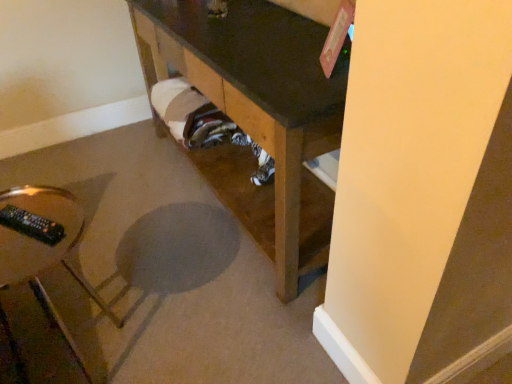
Where is `clear glass remote control at lower left, arranged as the 2th furniture when viewed from the right`? clear glass remote control at lower left, arranged as the 2th furniture when viewed from the right is located at coordinates (41, 287).

This screenshot has width=512, height=384. What do you see at coordinates (41, 287) in the screenshot? I see `clear glass remote control at lower left, arranged as the 2th furniture when viewed from the right` at bounding box center [41, 287].

This screenshot has height=384, width=512. Find the location of `brown wood table at lower center, acting as the second furniture starting from the left`. brown wood table at lower center, acting as the second furniture starting from the left is located at coordinates (258, 113).

What do you see at coordinates (258, 113) in the screenshot?
I see `brown wood table at lower center, acting as the second furniture starting from the left` at bounding box center [258, 113].

How much space does brown wood table at lower center, positioned as the 1th furniture in right-to-left order, occupy horizontally?

brown wood table at lower center, positioned as the 1th furniture in right-to-left order, is 21.70 inches wide.

Locate an element on the screen. The width and height of the screenshot is (512, 384). clear glass remote control at lower left, the first furniture when ordered from left to right is located at coordinates (41, 287).

Which object is positioned more to the right, brown wood table at lower center, positioned as the 1th furniture in right-to-left order, or clear glass remote control at lower left, arranged as the 2th furniture when viewed from the right?

brown wood table at lower center, positioned as the 1th furniture in right-to-left order.

Does brown wood table at lower center, positioned as the 1th furniture in right-to-left order, lie in front of clear glass remote control at lower left, arranged as the 2th furniture when viewed from the right?

No, brown wood table at lower center, positioned as the 1th furniture in right-to-left order, is further to the viewer.

Is point (305, 230) positioned behind point (57, 220)?

Yes, it is.

From the image's perspective, which one is positioned higher, brown wood table at lower center, acting as the second furniture starting from the left, or clear glass remote control at lower left, arranged as the 2th furniture when viewed from the right?

brown wood table at lower center, acting as the second furniture starting from the left, is shown above in the image.

From a real-world perspective, between brown wood table at lower center, acting as the second furniture starting from the left, and clear glass remote control at lower left, arranged as the 2th furniture when viewed from the right, who is vertically higher?

brown wood table at lower center, acting as the second furniture starting from the left, is physically above.

Which object is wider, brown wood table at lower center, acting as the second furniture starting from the left, or clear glass remote control at lower left, arranged as the 2th furniture when viewed from the right?

With larger width is brown wood table at lower center, acting as the second furniture starting from the left.

Which of these two, brown wood table at lower center, acting as the second furniture starting from the left, or clear glass remote control at lower left, the first furniture when ordered from left to right, stands shorter?

clear glass remote control at lower left, the first furniture when ordered from left to right, is shorter.

Looking at the image, does brown wood table at lower center, positioned as the 1th furniture in right-to-left order, seem bigger or smaller compared to clear glass remote control at lower left, the first furniture when ordered from left to right?

brown wood table at lower center, positioned as the 1th furniture in right-to-left order, is bigger than clear glass remote control at lower left, the first furniture when ordered from left to right.

Do you think brown wood table at lower center, acting as the second furniture starting from the left, is within clear glass remote control at lower left, arranged as the 2th furniture when viewed from the right, or outside of it?

→ The correct answer is: outside.

Are brown wood table at lower center, acting as the second furniture starting from the left, and clear glass remote control at lower left, arranged as the 2th furniture when viewed from the right, beside each other?

No, brown wood table at lower center, acting as the second furniture starting from the left, is not making contact with clear glass remote control at lower left, arranged as the 2th furniture when viewed from the right.

In the scene shown: Does brown wood table at lower center, positioned as the 1th furniture in right-to-left order, turn towards clear glass remote control at lower left, arranged as the 2th furniture when viewed from the right?

Yes, brown wood table at lower center, positioned as the 1th furniture in right-to-left order, is aimed at clear glass remote control at lower left, arranged as the 2th furniture when viewed from the right.

Find the location of a particular element. Image resolution: width=512 pixels, height=384 pixels. furniture in front of the brown wood table at lower center, acting as the second furniture starting from the left is located at coordinates (41, 287).

Which object is positioned more to the left, clear glass remote control at lower left, the first furniture when ordered from left to right, or brown wood table at lower center, acting as the second furniture starting from the left?

Positioned to the left is clear glass remote control at lower left, the first furniture when ordered from left to right.

Is clear glass remote control at lower left, arranged as the 2th furniture when viewed from the right, in front of or behind brown wood table at lower center, positioned as the 1th furniture in right-to-left order, in the image?

In the image, clear glass remote control at lower left, arranged as the 2th furniture when viewed from the right, appears in front of brown wood table at lower center, positioned as the 1th furniture in right-to-left order.

Is point (21, 333) less distant than point (304, 131)?

No, it is not.

From the image's perspective, would you say clear glass remote control at lower left, arranged as the 2th furniture when viewed from the right, is positioned over brown wood table at lower center, acting as the second furniture starting from the left?

Incorrect, from the image's perspective, clear glass remote control at lower left, arranged as the 2th furniture when viewed from the right, is lower than brown wood table at lower center, acting as the second furniture starting from the left.

From a real-world perspective, is clear glass remote control at lower left, the first furniture when ordered from left to right, positioned over brown wood table at lower center, acting as the second furniture starting from the left, based on gravity?

No, from a real-world perspective, clear glass remote control at lower left, the first furniture when ordered from left to right, is not on top of brown wood table at lower center, acting as the second furniture starting from the left.

Between clear glass remote control at lower left, arranged as the 2th furniture when viewed from the right, and brown wood table at lower center, acting as the second furniture starting from the left, which one has larger width?

With larger width is brown wood table at lower center, acting as the second furniture starting from the left.

Considering the relative sizes of clear glass remote control at lower left, arranged as the 2th furniture when viewed from the right, and brown wood table at lower center, positioned as the 1th furniture in right-to-left order, in the image provided, is clear glass remote control at lower left, arranged as the 2th furniture when viewed from the right, taller than brown wood table at lower center, positioned as the 1th furniture in right-to-left order,?

Incorrect, the height of clear glass remote control at lower left, arranged as the 2th furniture when viewed from the right, is not larger of that of brown wood table at lower center, positioned as the 1th furniture in right-to-left order.

Can you confirm if clear glass remote control at lower left, the first furniture when ordered from left to right, is bigger than brown wood table at lower center, acting as the second furniture starting from the left?

Actually, clear glass remote control at lower left, the first furniture when ordered from left to right, might be smaller than brown wood table at lower center, acting as the second furniture starting from the left.

Could brown wood table at lower center, positioned as the 1th furniture in right-to-left order, be considered to be inside clear glass remote control at lower left, arranged as the 2th furniture when viewed from the right?

No, brown wood table at lower center, positioned as the 1th furniture in right-to-left order, is not inside clear glass remote control at lower left, arranged as the 2th furniture when viewed from the right.

Is clear glass remote control at lower left, arranged as the 2th furniture when viewed from the right, not near brown wood table at lower center, positioned as the 1th furniture in right-to-left order?

No, clear glass remote control at lower left, arranged as the 2th furniture when viewed from the right, is in close proximity to brown wood table at lower center, positioned as the 1th furniture in right-to-left order.

Is clear glass remote control at lower left, arranged as the 2th furniture when viewed from the right, turned away from brown wood table at lower center, acting as the second furniture starting from the left?

clear glass remote control at lower left, arranged as the 2th furniture when viewed from the right, is not turned away from brown wood table at lower center, acting as the second furniture starting from the left.

How far apart are clear glass remote control at lower left, the first furniture when ordered from left to right, and brown wood table at lower center, positioned as the 1th furniture in right-to-left order?

clear glass remote control at lower left, the first furniture when ordered from left to right, is 78.01 centimeters away from brown wood table at lower center, positioned as the 1th furniture in right-to-left order.

Identify the location of furniture that appears behind the clear glass remote control at lower left, arranged as the 2th furniture when viewed from the right. (258, 113).

This screenshot has width=512, height=384. What are the coordinates of `furniture located above the clear glass remote control at lower left, arranged as the 2th furniture when viewed from the right (from a real-world perspective)` in the screenshot? It's located at (258, 113).

This screenshot has width=512, height=384. Find the location of `furniture that is behind the clear glass remote control at lower left, the first furniture when ordered from left to right`. furniture that is behind the clear glass remote control at lower left, the first furniture when ordered from left to right is located at coordinates (258, 113).